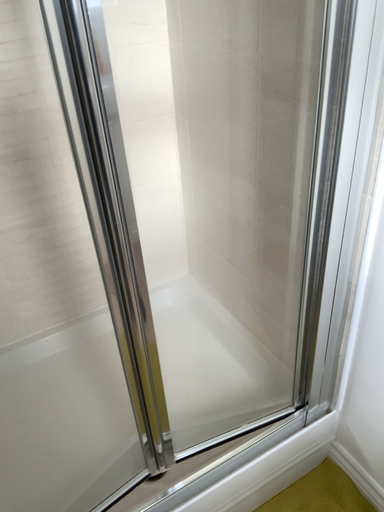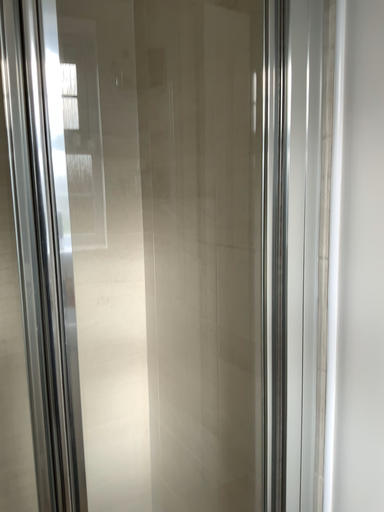
Question: Which way did the camera rotate in the video?

Choices:
 (A) rotated downward
 (B) rotated upward

Answer: (B)